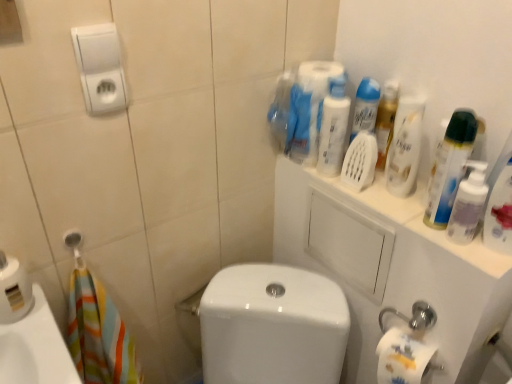
Question: Can you confirm if translucent plastic spray bottle at upper right, the 1th cleaning product positioned from the right, is taller than white plastic hand dryer at upper left?

Choices:
 (A) yes
 (B) no

Answer: (A)

Question: Can you confirm if translucent plastic spray bottle at upper right, the 1th cleaning product positioned from the right, is thinner than white plastic hand dryer at upper left?

Choices:
 (A) no
 (B) yes

Answer: (A)

Question: From a real-world perspective, does translucent plastic spray bottle at upper right, the 1th cleaning product positioned from the right, sit lower than white plastic hand dryer at upper left?

Choices:
 (A) yes
 (B) no

Answer: (A)

Question: From a real-world perspective, is translucent plastic spray bottle at upper right, the fourth cleaning product from the left, on white plastic hand dryer at upper left?

Choices:
 (A) no
 (B) yes

Answer: (A)

Question: Is white plastic hand dryer at upper left located within translucent plastic spray bottle at upper right, the fourth cleaning product from the left?

Choices:
 (A) yes
 (B) no

Answer: (B)

Question: Could you tell me if translucent plastic spray bottle at upper right, the 1th cleaning product positioned from the right, is facing white plastic hand dryer at upper left?

Choices:
 (A) yes
 (B) no

Answer: (B)

Question: Is translucent plastic bottle at upper right, the 3th cleaning product from the left, to the left of transparent plastic mouthwash at upper right from the viewer's perspective?

Choices:
 (A) yes
 (B) no

Answer: (A)

Question: Is translucent plastic bottle at upper right, the 3th cleaning product from the left, looking in the opposite direction of transparent plastic mouthwash at upper right?

Choices:
 (A) no
 (B) yes

Answer: (A)

Question: From a real-world perspective, is translucent plastic bottle at upper right, the 2th cleaning product positioned from the right, positioned over transparent plastic mouthwash at upper right based on gravity?

Choices:
 (A) no
 (B) yes

Answer: (B)

Question: Is translucent plastic bottle at upper right, the 2th cleaning product positioned from the right, shorter than transparent plastic mouthwash at upper right?

Choices:
 (A) yes
 (B) no

Answer: (B)

Question: Is translucent plastic bottle at upper right, the 2th cleaning product positioned from the right, outside of transparent plastic mouthwash at upper right?

Choices:
 (A) yes
 (B) no

Answer: (A)

Question: Does translucent plastic bottle at upper right, the 2th cleaning product positioned from the right, turn towards transparent plastic mouthwash at upper right?

Choices:
 (A) yes
 (B) no

Answer: (B)

Question: From a real-world perspective, is white glossy porcelain at center, arranged as the first porcelain when viewed from the left, located beneath translucent plastic bottle at upper right, the 3th cleaning product from the left?

Choices:
 (A) no
 (B) yes

Answer: (B)